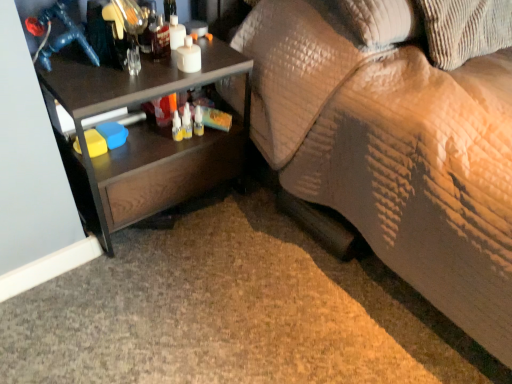
Identify the location of free space in front of dark wood desk at left. The width and height of the screenshot is (512, 384). (147, 296).